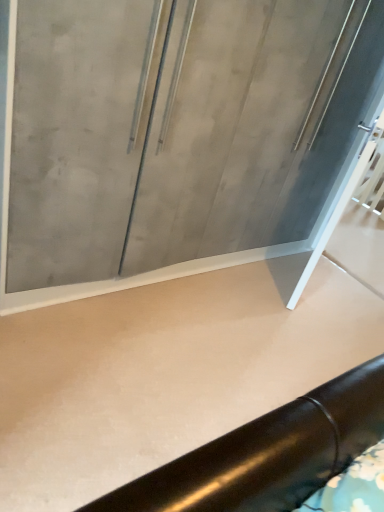
Describe the element at coordinates (179, 137) in the screenshot. This screenshot has height=512, width=384. I see `matte gray glass door at center` at that location.

You are a GUI agent. You are given a task and a screenshot of the screen. Output one action in this format:
    pyautogui.click(x=<x>, y=<y>)
    Task: Click on the matte gray glass door at center
    
    Given the screenshot: What is the action you would take?
    pyautogui.click(x=179, y=137)

The height and width of the screenshot is (512, 384). Find the location of `smooth concrete at center`. smooth concrete at center is located at coordinates (163, 374).

The height and width of the screenshot is (512, 384). Describe the element at coordinates (163, 374) in the screenshot. I see `smooth concrete at center` at that location.

Locate an element on the screen. matte gray glass door at center is located at coordinates (179, 137).

Considering the positions of objects matte gray glass door at center and smooth concrete at center in the image provided, who is more to the right, matte gray glass door at center or smooth concrete at center?

From the viewer's perspective, smooth concrete at center appears more on the right side.

Is matte gray glass door at center further to camera compared to smooth concrete at center?

Yes, it is behind smooth concrete at center.

Is point (195, 47) closer to camera compared to point (307, 321)?

Yes, point (195, 47) is closer to viewer.

From the image's perspective, is matte gray glass door at center above or below smooth concrete at center?

Based on their image positions, matte gray glass door at center is located above smooth concrete at center.

From a real-world perspective, is matte gray glass door at center beneath smooth concrete at center?

No.

Is matte gray glass door at center thinner than smooth concrete at center?

Indeed, matte gray glass door at center has a lesser width compared to smooth concrete at center.

Is matte gray glass door at center taller than smooth concrete at center?

Correct, matte gray glass door at center is much taller as smooth concrete at center.

Considering the sizes of objects matte gray glass door at center and smooth concrete at center in the image provided, who is bigger, matte gray glass door at center or smooth concrete at center?

matte gray glass door at center is bigger.

Is matte gray glass door at center inside the boundaries of smooth concrete at center, or outside?

matte gray glass door at center lies outside smooth concrete at center.

Is matte gray glass door at center far away from smooth concrete at center?

No, matte gray glass door at center is not far from smooth concrete at center.

Is matte gray glass door at center oriented towards smooth concrete at center?

Yes, matte gray glass door at center is facing smooth concrete at center.

The image size is (384, 512). I want to click on glass door behind the smooth concrete at center, so click(179, 137).

Considering the relative positions of smooth concrete at center and matte gray glass door at center in the image provided, is smooth concrete at center to the right of matte gray glass door at center from the viewer's perspective?

Indeed, smooth concrete at center is positioned on the right side of matte gray glass door at center.

Consider the image. Is the position of smooth concrete at center less distant than that of matte gray glass door at center?

Yes, it is in front of matte gray glass door at center.

Does point (177, 399) appear closer or farther from the camera than point (375, 62)?

Point (177, 399) is closer to the camera than point (375, 62).

From the image's perspective, does smooth concrete at center appear higher than matte gray glass door at center?

No, from the image's perspective, smooth concrete at center is not over matte gray glass door at center.

From a real-world perspective, is smooth concrete at center located higher than matte gray glass door at center?

No.

From the picture: Considering the relative sizes of smooth concrete at center and matte gray glass door at center in the image provided, is smooth concrete at center thinner than matte gray glass door at center?

No.

Who is shorter, smooth concrete at center or matte gray glass door at center?

Standing shorter between the two is smooth concrete at center.

Consider the image. Does smooth concrete at center have a smaller size compared to matte gray glass door at center?

Yes.

Is smooth concrete at center located outside matte gray glass door at center?

Yes.

Are smooth concrete at center and matte gray glass door at center located far from each other?

No, smooth concrete at center is in close proximity to matte gray glass door at center.

Is smooth concrete at center turned away from matte gray glass door at center?

No, smooth concrete at center is not facing away from matte gray glass door at center.

Find the location of a particular element. The width and height of the screenshot is (384, 512). glass door that is above the smooth concrete at center (from a real-world perspective) is located at coordinates (179, 137).

In order to click on glass door behind the smooth concrete at center in this screenshot , I will do `click(179, 137)`.

I want to click on concrete below the matte gray glass door at center (from the image's perspective), so click(x=163, y=374).